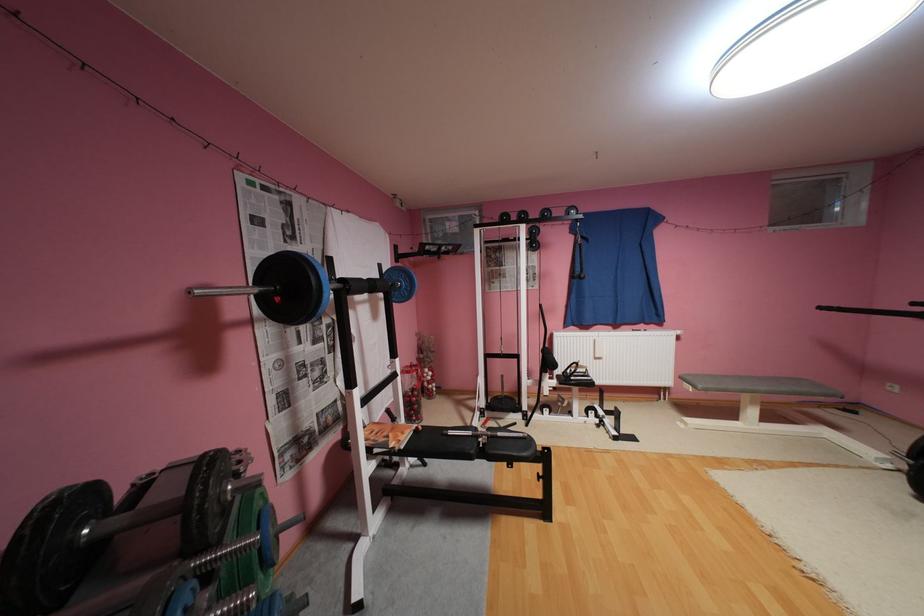
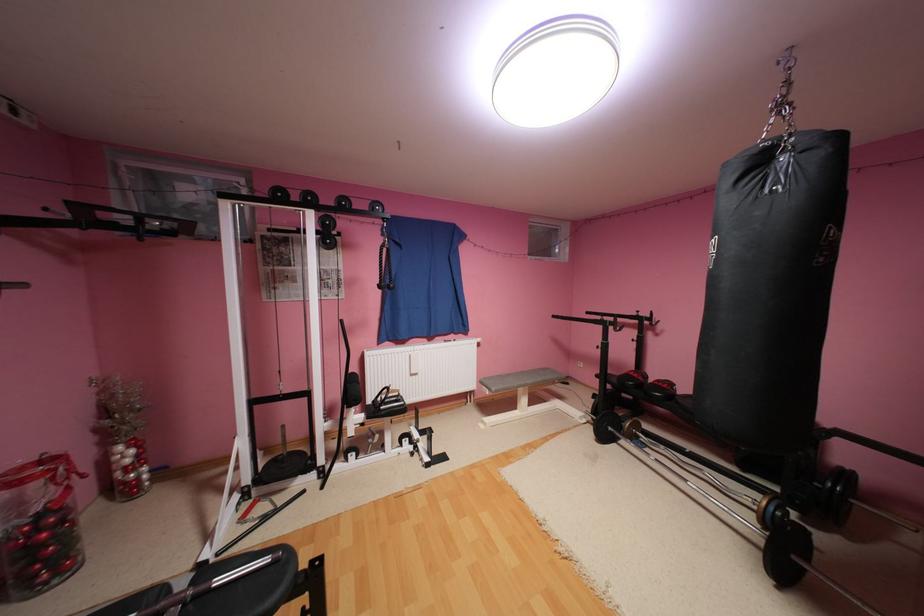
The point at (529, 435) is marked in the first image. Where is the corresponding point in the second image?

(276, 560)